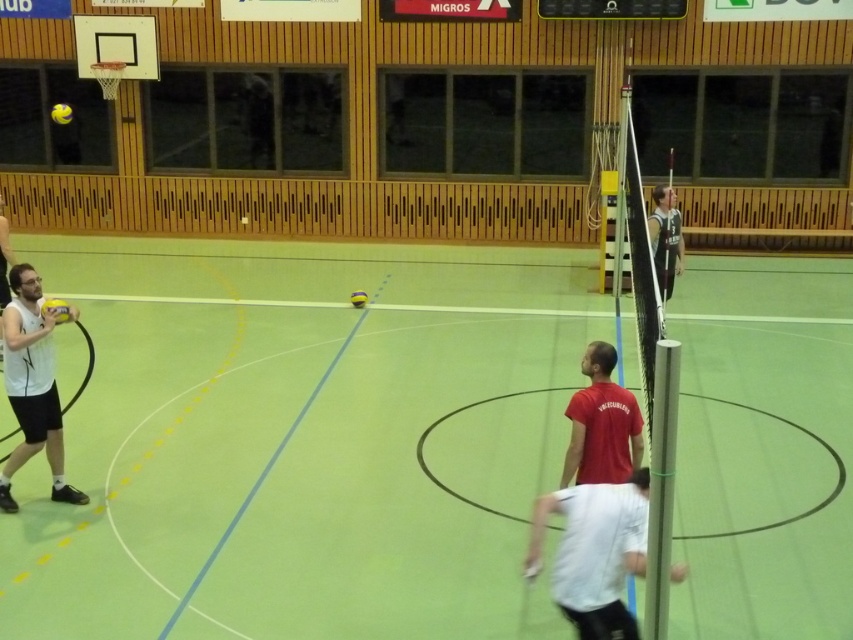
Which is behind, point (16, 275) or point (363, 296)?

Positioned behind is point (363, 296).

Between white matte/vinyl volleyball at left and yellow matte/vinyl volleyball at center, which one has less height?

With less height is yellow matte/vinyl volleyball at center.

Which is in front, point (20, 397) or point (363, 304)?

Point (20, 397) is more forward.

Where is `white matte/vinyl volleyball at left`? The height and width of the screenshot is (640, 853). white matte/vinyl volleyball at left is located at coordinates (32, 387).

Which is more to the left, red matte shirt at center or yellow matte/vinyl volleyball at center?

yellow matte/vinyl volleyball at center

Is point (608, 352) closer to viewer compared to point (363, 292)?

Yes, point (608, 352) is closer to viewer.

Does point (616, 385) come behind point (364, 296)?

No.

The width and height of the screenshot is (853, 640). In order to click on red matte shirt at center in this screenshot , I will do `click(601, 424)`.

Can you confirm if white matte/vinyl volleyball at left is wider than yellow matte volleyball at left?

Indeed, white matte/vinyl volleyball at left has a greater width compared to yellow matte volleyball at left.

Between point (26, 385) and point (61, 317), which one is positioned behind?

Positioned behind is point (61, 317).

Image resolution: width=853 pixels, height=640 pixels. I want to click on white matte/vinyl volleyball at left, so click(x=32, y=387).